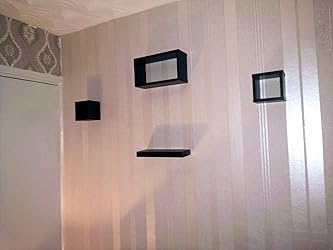
At what (x,y) coordinates should I click in order to perform the action: click on wall. Please return your answer as a coordinate pair (x, y). Looking at the image, I should click on (233, 205).